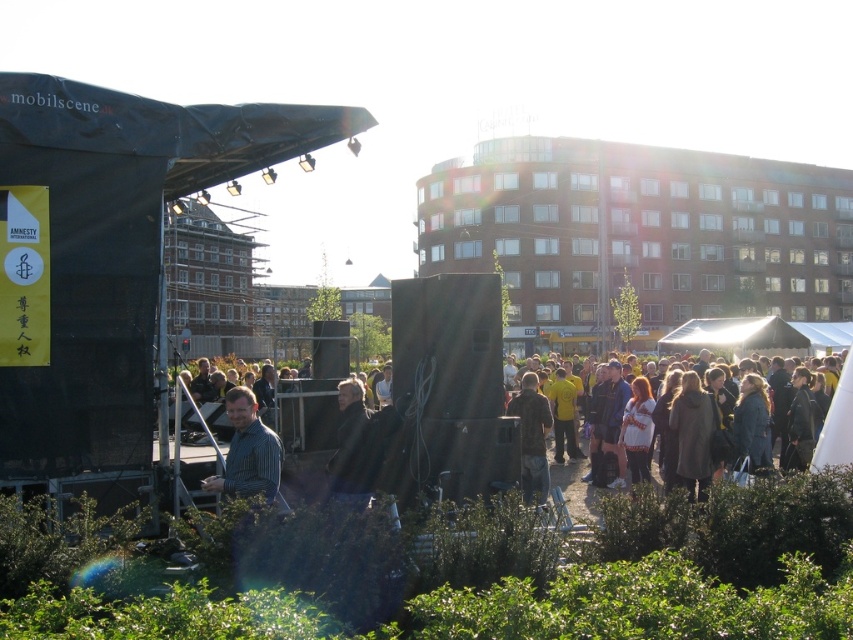
Question: Does striped shirt at center appear over camouflage fabric jacket at center?

Choices:
 (A) yes
 (B) no

Answer: (A)

Question: Is striped shirt at center wider than camouflage fabric jacket at center?

Choices:
 (A) no
 (B) yes

Answer: (A)

Question: Can you confirm if striped shirt at center is wider than camouflage fabric jacket at center?

Choices:
 (A) no
 (B) yes

Answer: (A)

Question: Which object is closer to the camera taking this photo?

Choices:
 (A) striped shirt at center
 (B) camouflage fabric jacket at center

Answer: (B)

Question: Among these objects, which one is nearest to the camera?

Choices:
 (A) striped shirt at center
 (B) camouflage fabric jacket at center

Answer: (B)